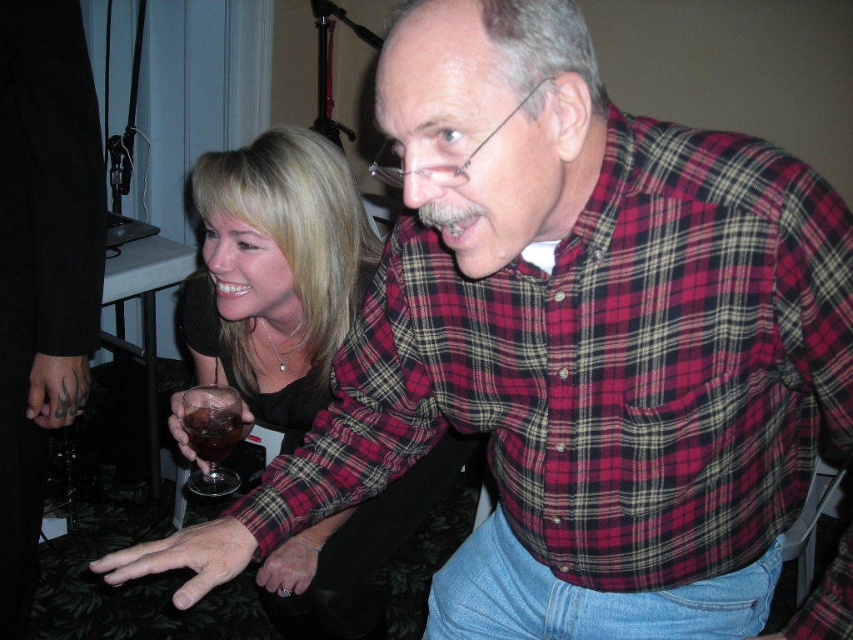
Question: Considering the relative positions of translucent glass wine at lower left and translucent glass drink at center in the image provided, where is translucent glass wine at lower left located with respect to translucent glass drink at center?

Choices:
 (A) below
 (B) above

Answer: (A)

Question: Which of these objects is positioned closest to the matte black dress at center?

Choices:
 (A) plaid cotton shirt at center
 (B) translucent glass drink at center
 (C) translucent glass wine at lower left

Answer: (C)

Question: Is plaid cotton shirt at center further to the viewer compared to translucent glass drink at center?

Choices:
 (A) no
 (B) yes

Answer: (A)

Question: Estimate the real-world distances between objects in this image. Which object is farther from the translucent glass drink at center?

Choices:
 (A) plaid cotton shirt at center
 (B) translucent glass wine at lower left
 (C) matte black dress at center

Answer: (A)

Question: Which object is closer to the camera taking this photo?

Choices:
 (A) translucent glass drink at center
 (B) plaid cotton shirt at center
 (C) translucent glass wine at lower left
 (D) matte black dress at center

Answer: (B)

Question: Can you confirm if plaid cotton shirt at center is positioned above translucent glass wine at lower left?

Choices:
 (A) no
 (B) yes

Answer: (B)